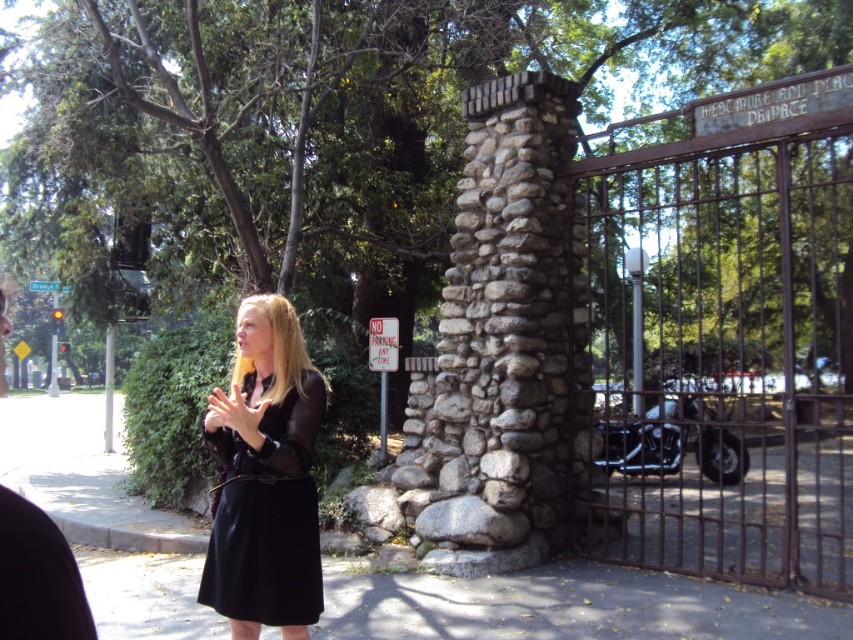
From the picture: Is gray concrete pavement at lower center smaller than black leather coat at center?

Correct, gray concrete pavement at lower center occupies less space than black leather coat at center.

Which is more to the left, gray concrete pavement at lower center or black leather coat at center?

gray concrete pavement at lower center

Between point (131, 602) and point (224, 422), which one is positioned in front?

Positioned in front is point (224, 422).

Where is `gray concrete pavement at lower center`? gray concrete pavement at lower center is located at coordinates (566, 605).

Can you confirm if black leather coat at center is thinner than blonde hair at center?

Incorrect, black leather coat at center's width is not less than blonde hair at center's.

Identify the location of black leather coat at center. (265, 474).

Which is behind, point (248, 604) or point (289, 364)?

Positioned behind is point (289, 364).

Locate an element on the screen. The image size is (853, 640). black leather coat at center is located at coordinates (265, 474).

Does point (358, 595) lie in front of point (283, 369)?

No, (358, 595) is behind (283, 369).

Does gray concrete pavement at lower center have a larger size compared to blonde hair at center?

Indeed, gray concrete pavement at lower center has a larger size compared to blonde hair at center.

Find the location of a particular element. This screenshot has height=640, width=853. gray concrete pavement at lower center is located at coordinates (566, 605).